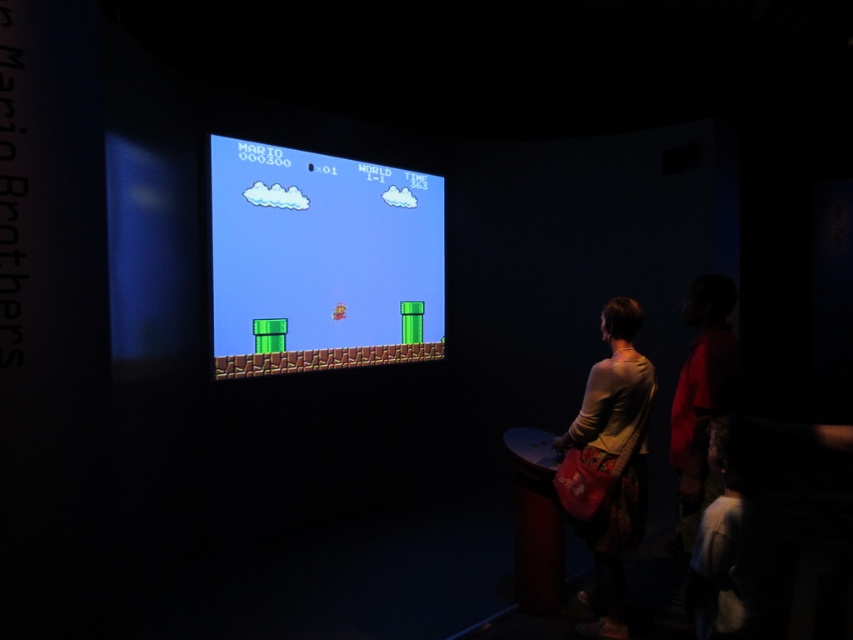
Question: Among these points, which one is farthest from the camera?

Choices:
 (A) (393, 310)
 (B) (640, 536)

Answer: (A)

Question: Can you confirm if matte plastic screen at center is thinner than light brown fabric bag at center?

Choices:
 (A) yes
 (B) no

Answer: (B)

Question: Which point appears closest to the camera in this image?

Choices:
 (A) (608, 422)
 (B) (416, 353)

Answer: (A)

Question: Considering the relative positions of matte plastic screen at center and light brown fabric bag at center in the image provided, where is matte plastic screen at center located with respect to light brown fabric bag at center?

Choices:
 (A) above
 (B) below

Answer: (A)

Question: Does matte plastic screen at center have a lesser width compared to light brown fabric bag at center?

Choices:
 (A) no
 (B) yes

Answer: (A)